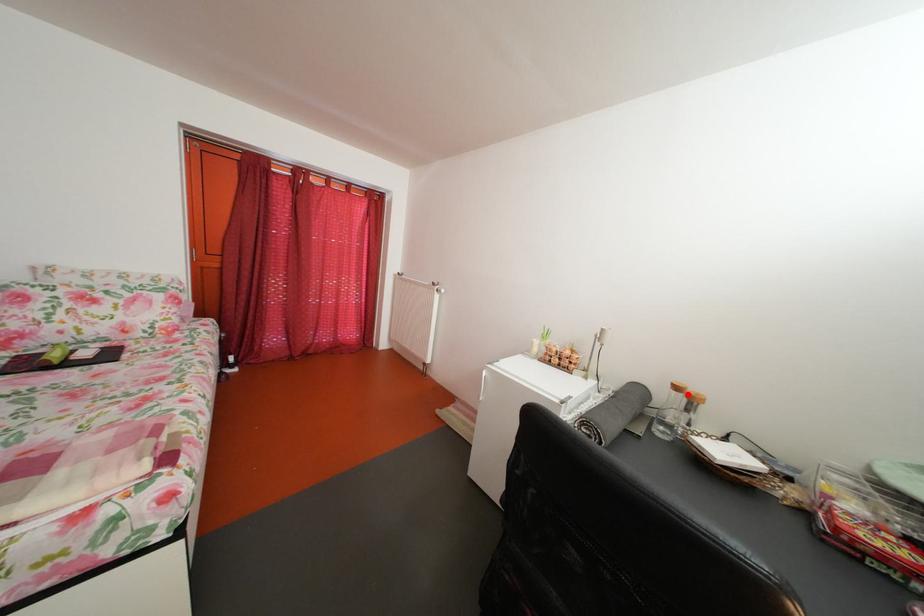
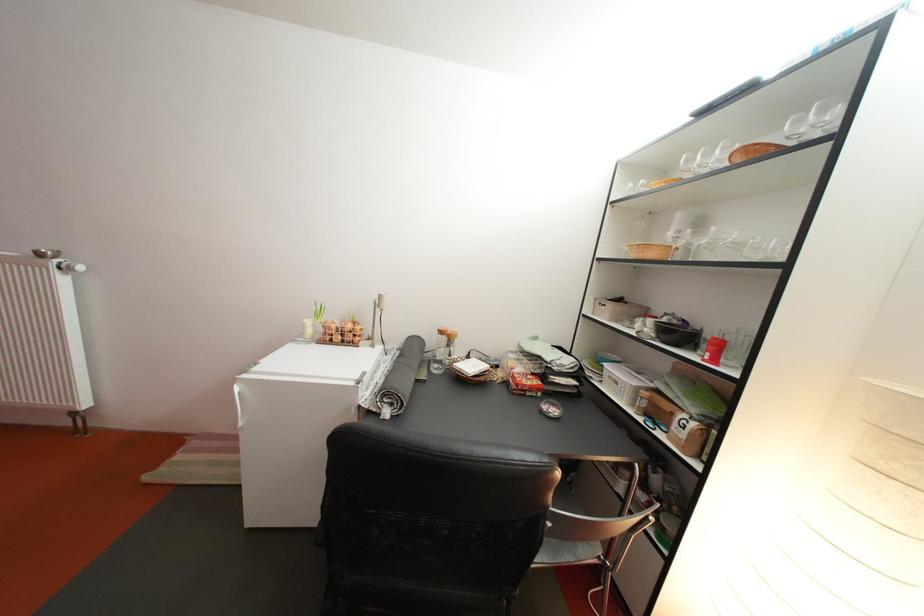
Find the pixel in the second image that matches the highlighted location in the first image.

(453, 339)